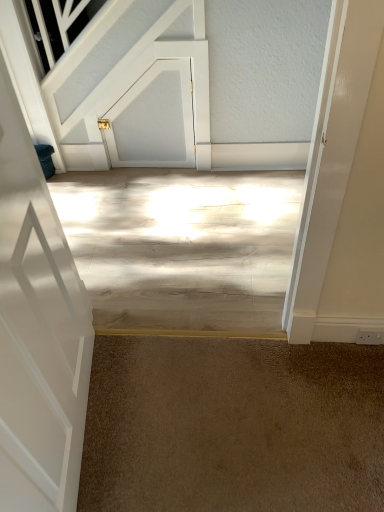
Identify the location of spots to the right of white matte door at upper center, the 1th door viewed from the top. (208, 177).